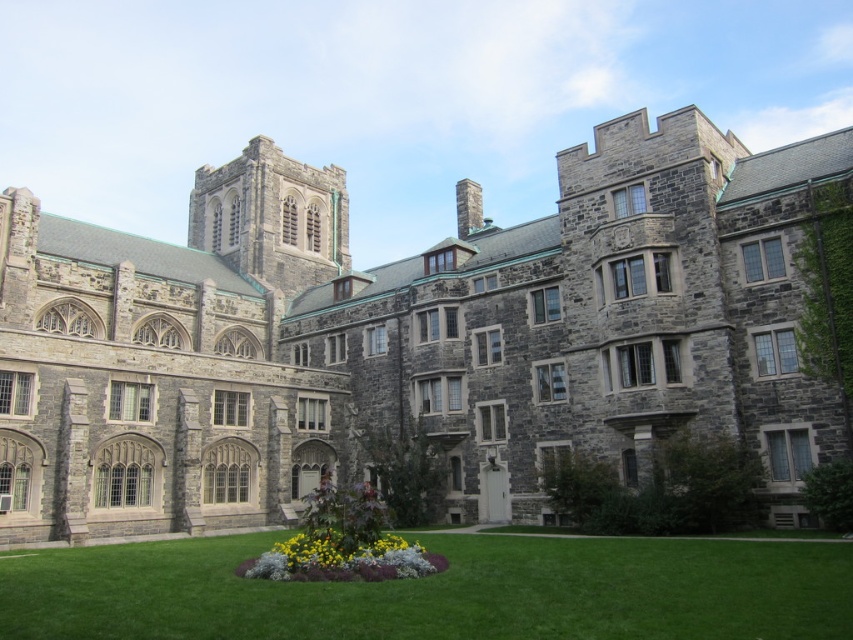
Question: Which object is closer to the camera taking this photo?

Choices:
 (A) green grass at lower center
 (B) yellow matte flowers at center

Answer: (A)

Question: Can you confirm if green grass at lower center is positioned to the left of yellow matte flowers at center?

Choices:
 (A) yes
 (B) no

Answer: (B)

Question: Considering the relative positions of green grass at lower center and yellow matte flowers at center in the image provided, where is green grass at lower center located with respect to yellow matte flowers at center?

Choices:
 (A) left
 (B) right

Answer: (B)

Question: Is green grass at lower center below yellow matte flowers at center?

Choices:
 (A) yes
 (B) no

Answer: (B)

Question: Which object appears closest to the camera in this image?

Choices:
 (A) yellow matte flowers at center
 (B) green grass at lower center

Answer: (B)